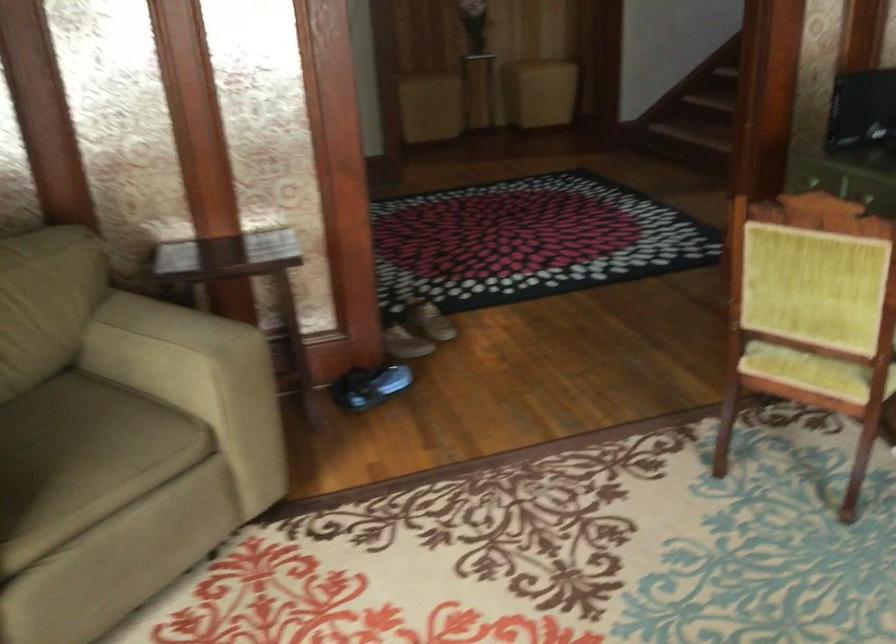
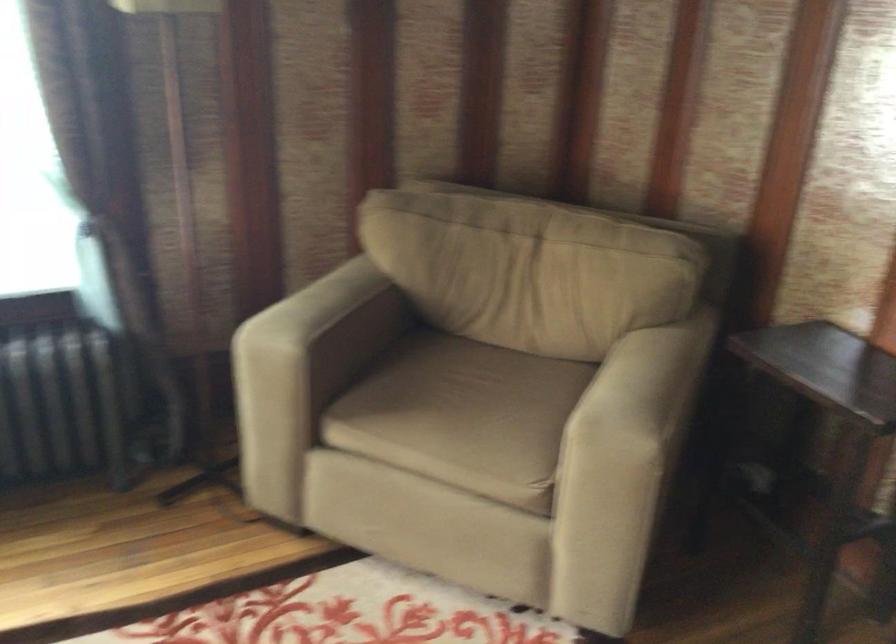
In the second image, find the point that corresponds to [229,327] in the first image.

(640, 413)